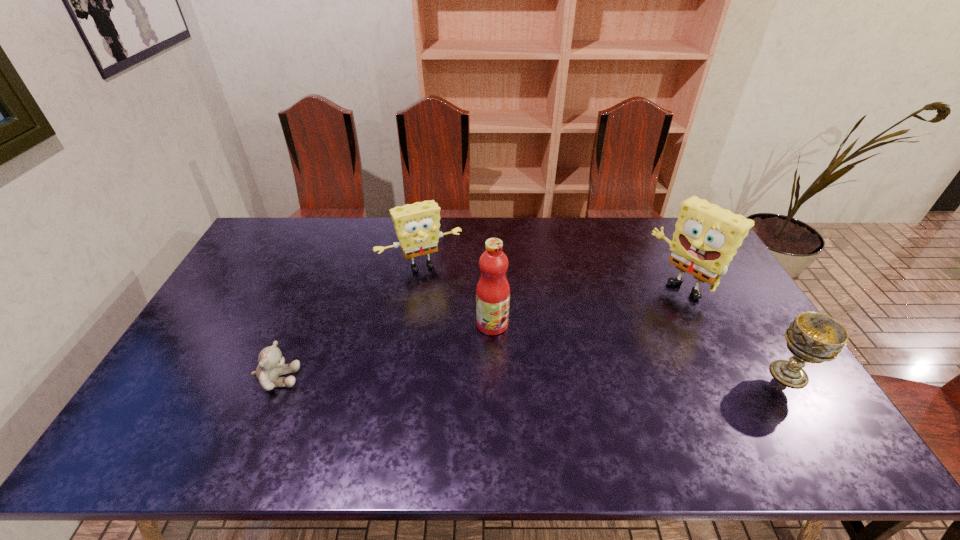
The width and height of the screenshot is (960, 540). What are the coordinates of `free spot located 0.270m on the face of the shortest object` in the screenshot? It's located at (403, 379).

Locate an element on the screen. free region located 0.060m on the front of the rightmost object is located at coordinates (814, 414).

Where is `free space located 0.190m on the face of the shorter sponge`? The image size is (960, 540). free space located 0.190m on the face of the shorter sponge is located at coordinates (455, 315).

The width and height of the screenshot is (960, 540). In order to click on vacant position located on the face of the shorter sponge in this screenshot , I will do `click(451, 307)`.

Where is `vacant area located on the face of the shorter sponge`? vacant area located on the face of the shorter sponge is located at coordinates (478, 359).

This screenshot has height=540, width=960. I want to click on vacant space located on the face of the taller sponge, so (x=647, y=312).

Find the location of a particular element. This screenshot has height=540, width=960. vacant space situated 0.290m on the face of the taller sponge is located at coordinates (602, 348).

Where is `vacant space located on the face of the taller sponge`? The width and height of the screenshot is (960, 540). vacant space located on the face of the taller sponge is located at coordinates (584, 363).

Locate an element on the screen. This screenshot has height=540, width=960. vacant space located 0.060m on the front label of the third nearest object is located at coordinates click(517, 345).

At what (x,y) coordinates should I click in order to perform the action: click on free space located 0.210m on the front label of the third nearest object. Please return your answer as a coordinate pair (x, y). Looking at the image, I should click on (558, 379).